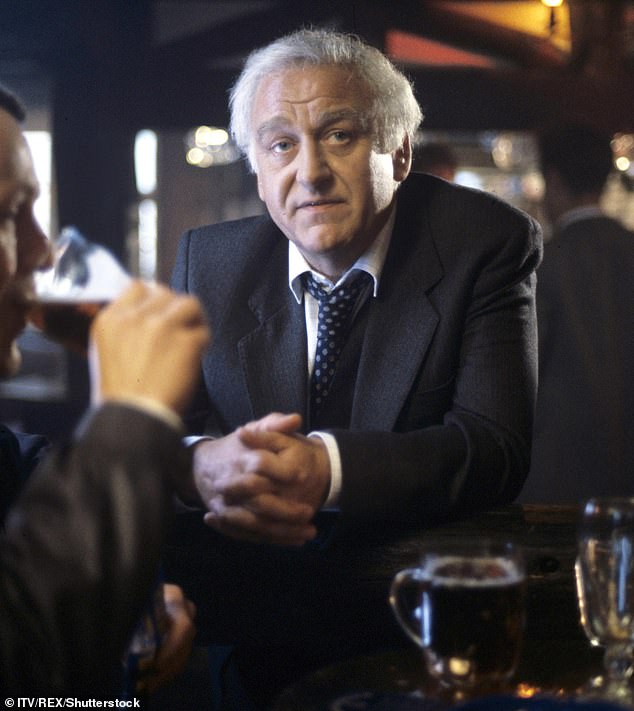
The height and width of the screenshot is (711, 634). I want to click on glassware, so click(78, 301), click(444, 592), click(598, 571).